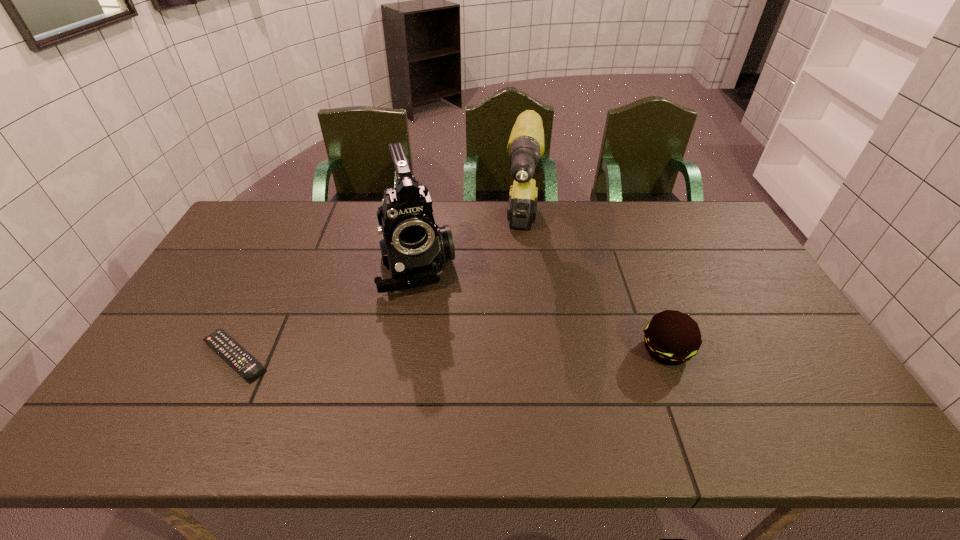
Identify the location of vacant region at the far edge. This screenshot has height=540, width=960. (313, 219).

The image size is (960, 540). Find the location of `free space at the near edge`. free space at the near edge is located at coordinates (444, 396).

In the image, there is a desktop. Identify the location of free space at the left edge. This screenshot has width=960, height=540. (239, 245).

You are a GUI agent. You are given a task and a screenshot of the screen. Output one action in this format:
    pyautogui.click(x=<x>, y=<y>)
    Task: Click on the vacant space at the right edge of the desktop
    The width and height of the screenshot is (960, 540).
    Given the screenshot: What is the action you would take?
    pyautogui.click(x=793, y=326)

Find the location of a particular element. The width and height of the screenshot is (960, 540). vacant region at the far left corner is located at coordinates (255, 226).

Image resolution: width=960 pixels, height=540 pixels. In the image, there is a desktop. What are the coordinates of `vacant area at the far right corner` in the screenshot? It's located at (718, 215).

Where is `free point between the patty and the remote control`? This screenshot has height=540, width=960. free point between the patty and the remote control is located at coordinates (450, 353).

Identify the location of free space between the rightmost object and the third object from left to right. (594, 293).

I want to click on free spot between the third object from left to right and the rightmost object, so click(x=594, y=293).

Locate an element on the screen. The height and width of the screenshot is (540, 960). vacant point located between the drill and the rightmost object is located at coordinates (594, 293).